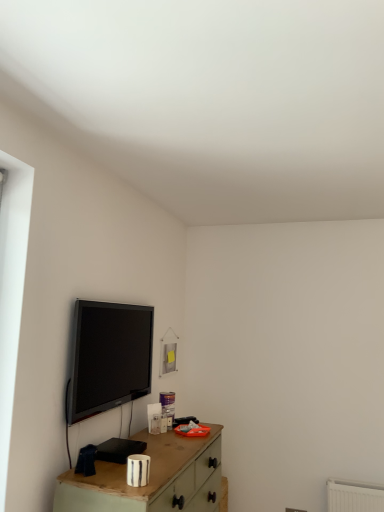
What do you see at coordinates (151, 478) in the screenshot? Image resolution: width=384 pixels, height=512 pixels. I see `wooden table at lower center` at bounding box center [151, 478].

The width and height of the screenshot is (384, 512). Identify the location of wooden table at lower center. (151, 478).

Describe the element at coordinates (109, 357) in the screenshot. This screenshot has width=384, height=512. I see `black glossy tv at upper left` at that location.

Locate an element on the screen. black glossy tv at upper left is located at coordinates (109, 357).

Image resolution: width=384 pixels, height=512 pixels. Find the location of `wooden table at lower center`. wooden table at lower center is located at coordinates (151, 478).

Considering the relative positions of wooden table at lower center and black glossy tv at upper left in the image provided, is wooden table at lower center to the left or to the right of black glossy tv at upper left?

Based on their positions, wooden table at lower center is located to the right of black glossy tv at upper left.

Which object is closer to the camera, wooden table at lower center or black glossy tv at upper left?

Positioned in front is wooden table at lower center.

Does point (196, 450) appear closer or farther from the camera than point (109, 372)?

Point (196, 450) is closer to the camera than point (109, 372).

From the image's perspective, is wooden table at lower center below black glossy tv at upper left?

Yes, from the image's perspective, wooden table at lower center is beneath black glossy tv at upper left.

From a real-world perspective, which is physically below, wooden table at lower center or black glossy tv at upper left?

In real-world perspective, wooden table at lower center is lower.

Which of these two, wooden table at lower center or black glossy tv at upper left, is thinner?

Thinner between the two is black glossy tv at upper left.

Is wooden table at lower center taller than black glossy tv at upper left?

Indeed, wooden table at lower center has a greater height compared to black glossy tv at upper left.

In terms of size, does wooden table at lower center appear bigger or smaller than black glossy tv at upper left?

In the image, wooden table at lower center appears to be larger than black glossy tv at upper left.

Would you say wooden table at lower center is outside black glossy tv at upper left?

Yes.

Is wooden table at lower center not near black glossy tv at upper left?

wooden table at lower center is actually quite close to black glossy tv at upper left.

Is wooden table at lower center positioned with its back to black glossy tv at upper left?

No, wooden table at lower center is not facing the opposite direction of black glossy tv at upper left.

In the scene shown: What's the angular difference between wooden table at lower center and black glossy tv at upper left's facing directions?

They differ by 0.446 degrees in their facing directions.

How far apart are wooden table at lower center and black glossy tv at upper left?

wooden table at lower center and black glossy tv at upper left are 18.77 inches apart.

You are a GUI agent. You are given a task and a screenshot of the screen. Output one action in this format:
    pyautogui.click(x=<x>, y=<y>)
    Task: Click on the table located on the right of black glossy tv at upper left
    The image size is (384, 512).
    Given the screenshot: What is the action you would take?
    pyautogui.click(x=151, y=478)

Would you say black glossy tv at upper left is to the left or to the right of wooden table at lower center in the picture?

black glossy tv at upper left is to the left of wooden table at lower center.

Between black glossy tv at upper left and wooden table at lower center, which one is positioned behind?

black glossy tv at upper left is behind.

Is point (84, 314) less distant than point (157, 483)?

No, it is behind (157, 483).

From the image's perspective, would you say black glossy tv at upper left is shown under wooden table at lower center?

No, from the image's perspective, black glossy tv at upper left is not beneath wooden table at lower center.

From a real-world perspective, is black glossy tv at upper left physically above wooden table at lower center?

Yes, from a real-world perspective, black glossy tv at upper left is on top of wooden table at lower center.

Is black glossy tv at upper left thinner than wooden table at lower center?

Indeed, black glossy tv at upper left has a lesser width compared to wooden table at lower center.

Is black glossy tv at upper left shorter than wooden table at lower center?

Yes, black glossy tv at upper left is shorter than wooden table at lower center.

Who is smaller, black glossy tv at upper left or wooden table at lower center?

Smaller between the two is black glossy tv at upper left.

Is black glossy tv at upper left outside of wooden table at lower center?

Yes, black glossy tv at upper left is located beyond the bounds of wooden table at lower center.

Are black glossy tv at upper left and wooden table at lower center far apart?

No, black glossy tv at upper left is not far from wooden table at lower center.

Is black glossy tv at upper left turned away from wooden table at lower center?

That's not correct — black glossy tv at upper left is not looking away from wooden table at lower center.

How different are the orientations of black glossy tv at upper left and wooden table at lower center in degrees?

The angular difference between black glossy tv at upper left and wooden table at lower center is 0.446 degrees.

This screenshot has height=512, width=384. Identify the location of television above the wooden table at lower center (from the image's perspective). pyautogui.click(x=109, y=357).

This screenshot has width=384, height=512. Find the location of `table in front of the black glossy tv at upper left`. table in front of the black glossy tv at upper left is located at coordinates (151, 478).

I want to click on television that appears above the wooden table at lower center (from the image's perspective), so click(x=109, y=357).